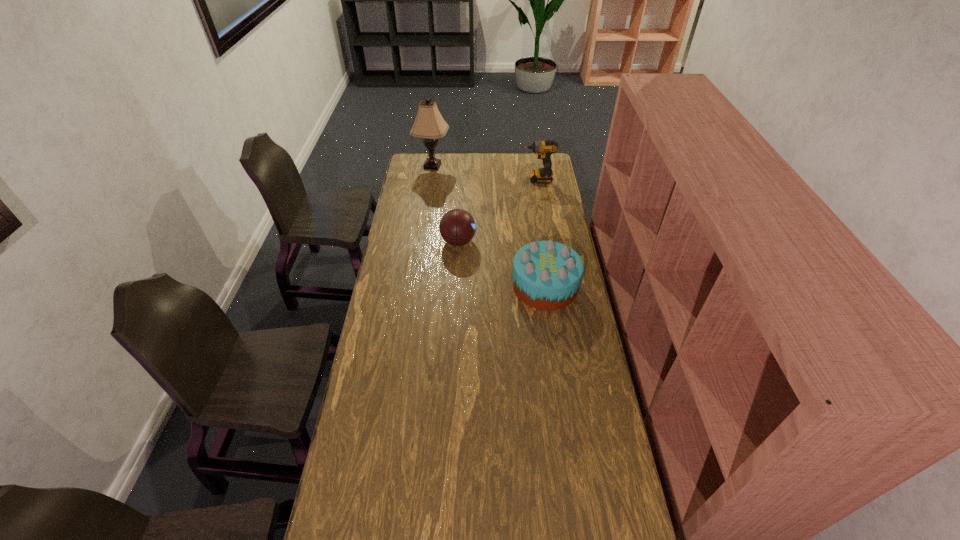
Where is `vacant point located 0.080m on the left of the nearest object`? This screenshot has height=540, width=960. vacant point located 0.080m on the left of the nearest object is located at coordinates (493, 286).

Identify the location of free location located on the back of the third farthest object. (461, 198).

The height and width of the screenshot is (540, 960). Find the location of `object that is at the far edge`. object that is at the far edge is located at coordinates (429, 124).

This screenshot has width=960, height=540. Identify the location of object at the left edge. (429, 124).

Where is `drill at the right edge`? This screenshot has height=540, width=960. drill at the right edge is located at coordinates (544, 149).

Identify the location of cake located in the right edge section of the desktop. This screenshot has height=540, width=960. pyautogui.click(x=547, y=275).

Locate an element on the screen. The height and width of the screenshot is (540, 960). object at the far left corner is located at coordinates (429, 124).

Identify the location of free location at the far edge of the desktop. The height and width of the screenshot is (540, 960). (450, 156).

In the image, there is a desktop. Identify the location of vacant space at the left edge. The height and width of the screenshot is (540, 960). (387, 307).

I want to click on vacant space at the right edge of the desktop, so click(x=583, y=294).